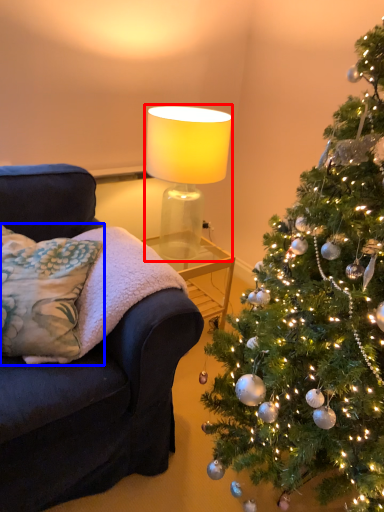
Question: Among these objects, which one is farthest to the camera, lamp (highlighted by a red box) or pillow (highlighted by a blue box)?

Choices:
 (A) lamp
 (B) pillow

Answer: (A)